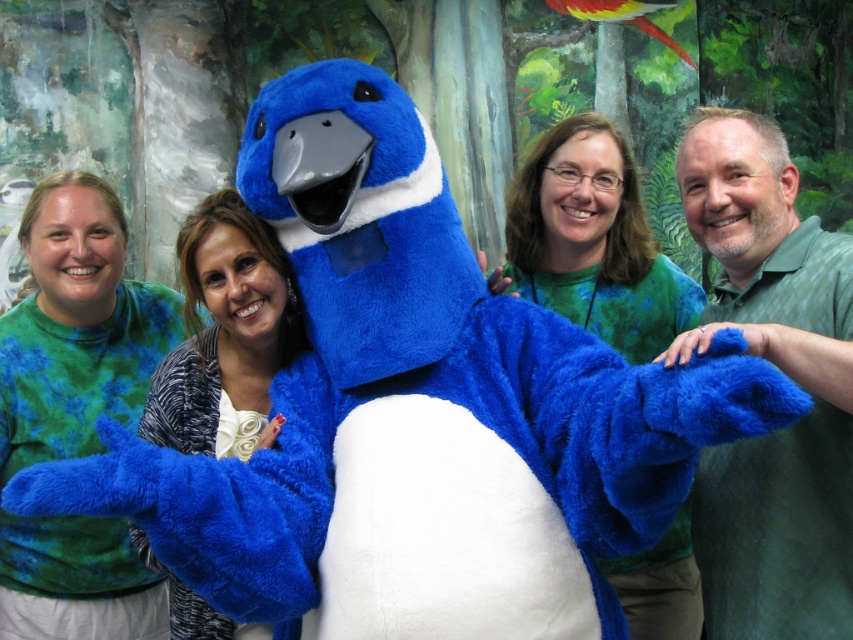
Question: Considering the real-world distances, which object is farthest from the green tie-dye shirt at center?

Choices:
 (A) blue plush at center
 (B) green textured shirt at right
 (C) matte green shirt at center

Answer: (B)

Question: Is the position of green tie-dye shirt at center less distant than that of blue plush at center?

Choices:
 (A) no
 (B) yes

Answer: (A)

Question: Which point appears farthest from the camera in this image?

Choices:
 (A) (39, 611)
 (B) (653, 570)
 (C) (178, 614)
 (D) (753, 301)

Answer: (A)

Question: Does green textured shirt at right appear under green tie-dye shirt at center?

Choices:
 (A) no
 (B) yes

Answer: (A)

Question: Which point is closer to the camera?

Choices:
 (A) blue plush at center
 (B) matte green shirt at center

Answer: (A)

Question: Can you confirm if green textured shirt at right is positioned below green tie-dye shirt at center?

Choices:
 (A) no
 (B) yes

Answer: (A)